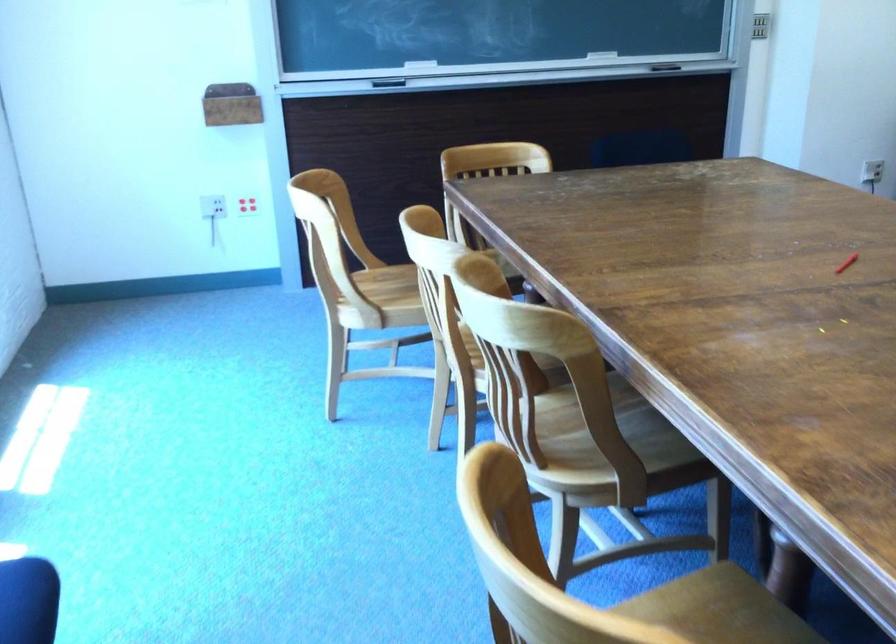
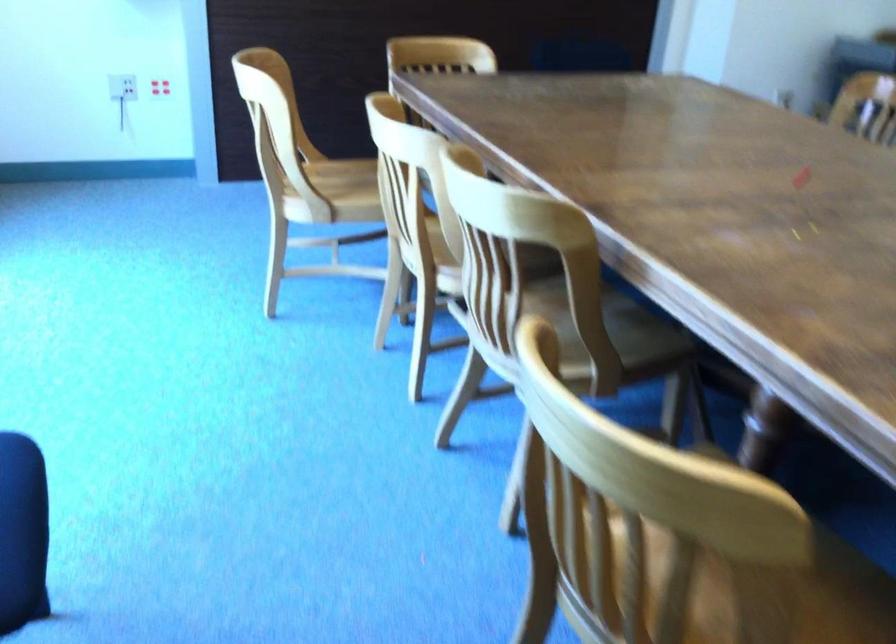
Question: The images are taken continuously from a first-person perspective. In which direction is your viewpoint rotating?

Choices:
 (A) Left
 (B) Right
 (C) Up
 (D) Down

Answer: (B)